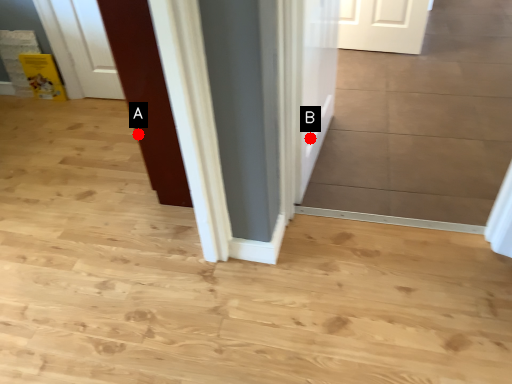
Question: Two points are circled on the image, labeled by A and B beside each circle. Which point is farther to the camera?

Choices:
 (A) A is further
 (B) B is further

Answer: (B)